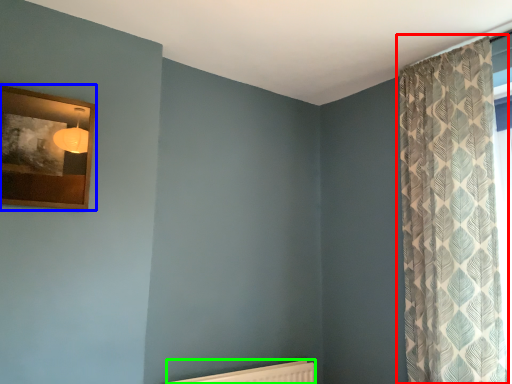
Question: Estimate the real-world distances between objects in this image. Which object is closer to curtain (highlighted by a red box), picture frame (highlighted by a blue box) or radiator (highlighted by a green box)?

Choices:
 (A) picture frame
 (B) radiator

Answer: (B)